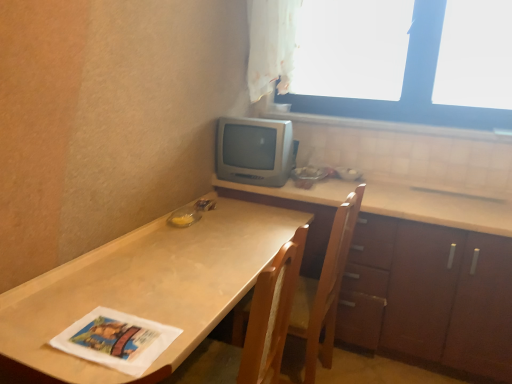
Question: Considering the relative positions of white sheer curtain at upper center and wooden cabinet at right in the image provided, is white sheer curtain at upper center behind wooden cabinet at right?

Choices:
 (A) no
 (B) yes

Answer: (B)

Question: From a real-world perspective, is white sheer curtain at upper center located higher than wooden cabinet at right?

Choices:
 (A) yes
 (B) no

Answer: (A)

Question: Can you confirm if white sheer curtain at upper center is thinner than wooden cabinet at right?

Choices:
 (A) no
 (B) yes

Answer: (B)

Question: Is white sheer curtain at upper center facing towards wooden cabinet at right?

Choices:
 (A) yes
 (B) no

Answer: (B)

Question: Considering the relative sizes of white sheer curtain at upper center and wooden cabinet at right in the image provided, is white sheer curtain at upper center smaller than wooden cabinet at right?

Choices:
 (A) no
 (B) yes

Answer: (B)

Question: Based on their sizes in the image, would you say wooden cabinet at right is bigger or smaller than white tile at upper right?

Choices:
 (A) big
 (B) small

Answer: (A)

Question: Is wooden cabinet at right wider or thinner than white tile at upper right?

Choices:
 (A) thin
 (B) wide

Answer: (B)

Question: Is wooden cabinet at right taller or shorter than white tile at upper right?

Choices:
 (A) short
 (B) tall

Answer: (B)

Question: Is wooden cabinet at right spatially inside white tile at upper right, or outside of it?

Choices:
 (A) inside
 (B) outside

Answer: (B)

Question: Choose the correct answer: Is wooden chair at center inside white tile at upper right or outside it?

Choices:
 (A) outside
 (B) inside

Answer: (A)

Question: Does point (328, 332) appear closer or farther from the camera than point (488, 135)?

Choices:
 (A) farther
 (B) closer

Answer: (B)

Question: Is wooden chair at center taller or shorter than white tile at upper right?

Choices:
 (A) tall
 (B) short

Answer: (A)

Question: Visually, is wooden chair at center positioned to the left or to the right of white tile at upper right?

Choices:
 (A) right
 (B) left

Answer: (B)

Question: Is wooden cabinet at right in front of or behind white sheer curtain at upper center in the image?

Choices:
 (A) behind
 (B) front

Answer: (B)

Question: Choose the correct answer: Is wooden cabinet at right inside white sheer curtain at upper center or outside it?

Choices:
 (A) inside
 (B) outside

Answer: (B)